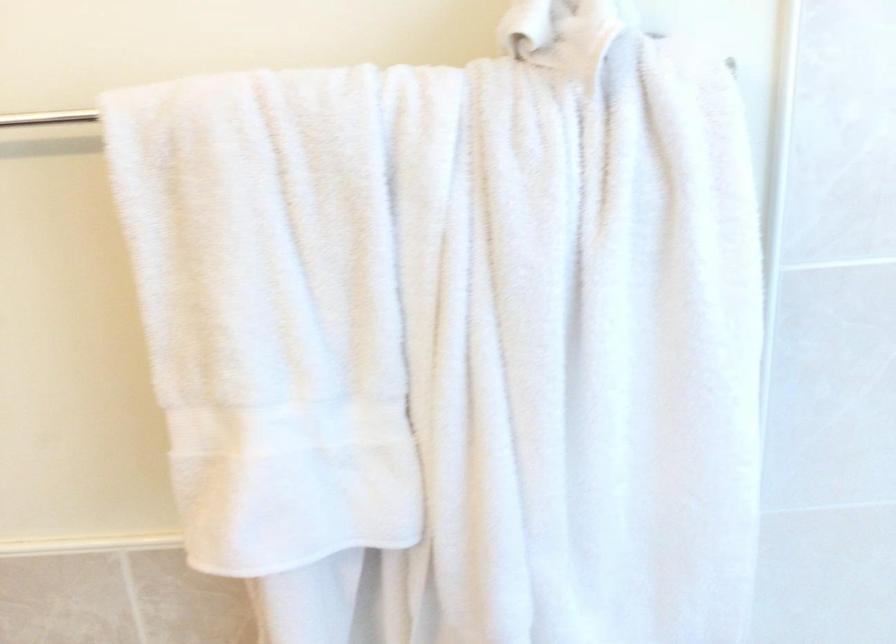
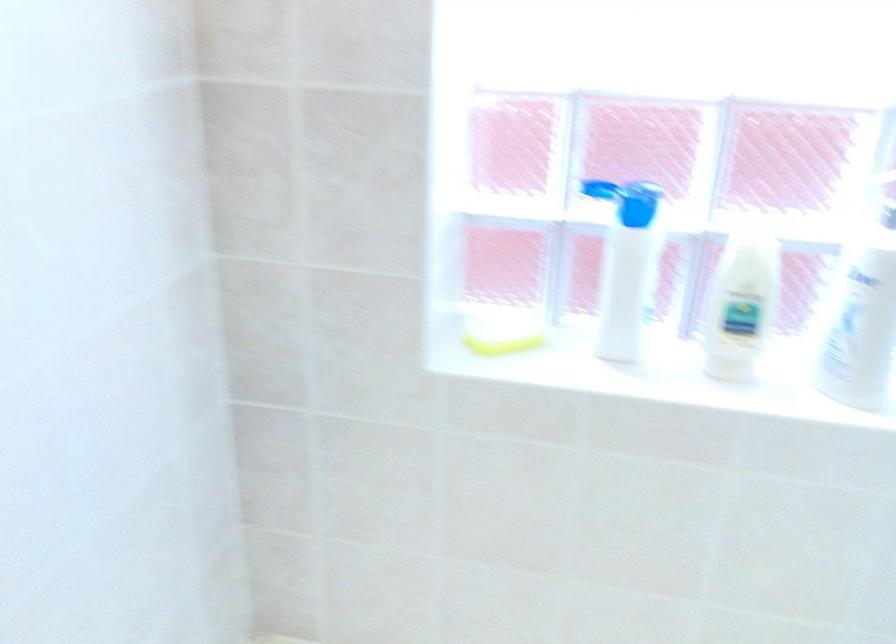
Question: The images are taken continuously from a first-person perspective. In which direction is your viewpoint rotating?

Choices:
 (A) Left
 (B) Right
 (C) Up
 (D) Down

Answer: (B)